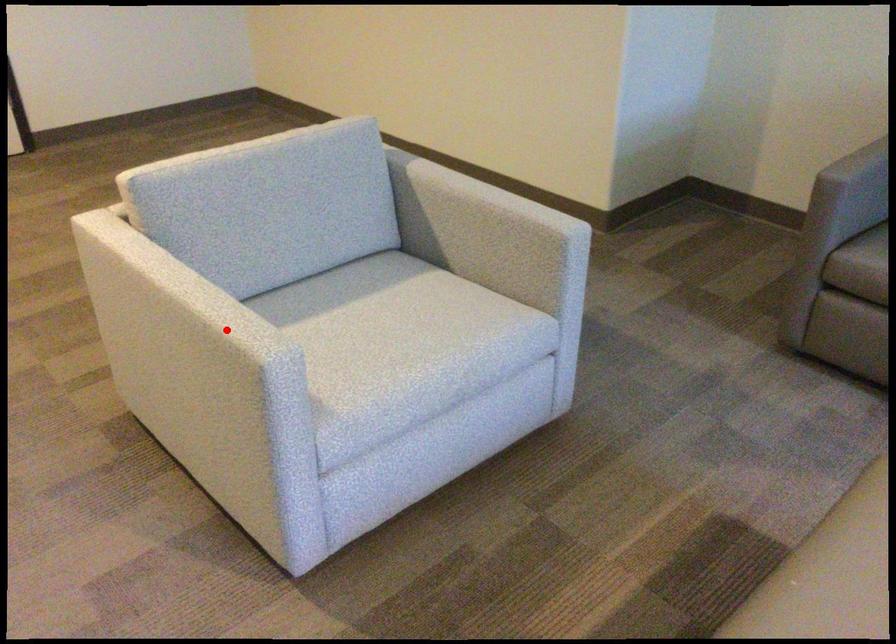
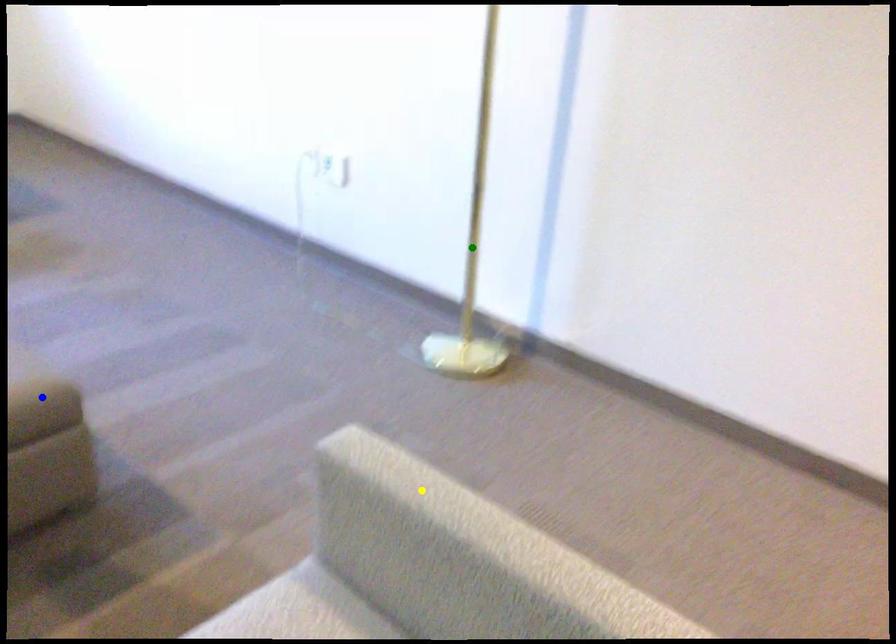
Question: I am providing you with two images of the same scene from different viewpoints. A red point is marked on the first image. You are given multiple points on the second image. Which mark in image 2 goes with the point in image 1?

Choices:
 (A) yellow point
 (B) green point
 (C) blue point

Answer: (A)